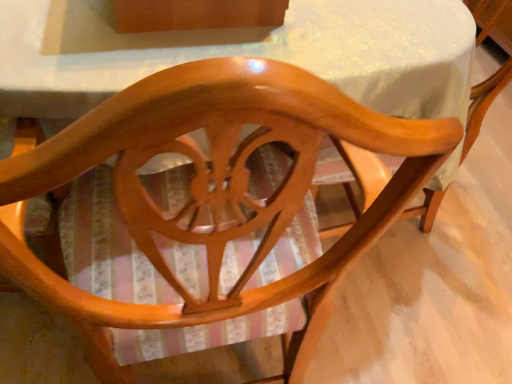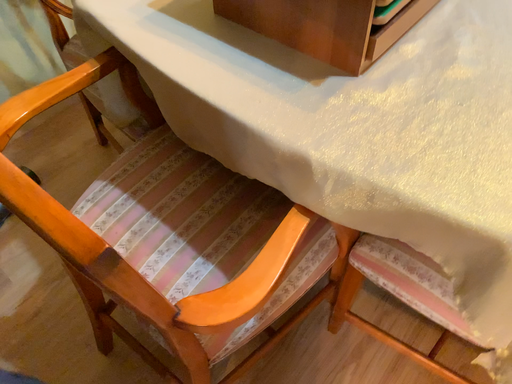
Question: How did the camera likely rotate when shooting the video?

Choices:
 (A) rotated left
 (B) rotated right

Answer: (A)